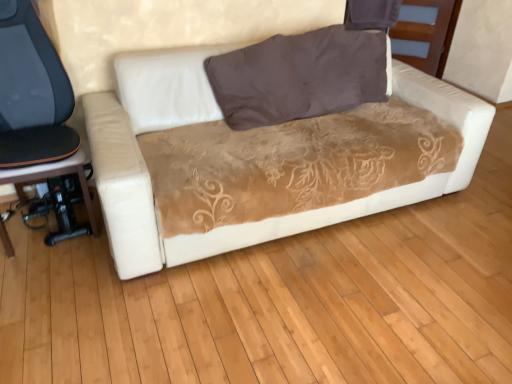
What do you see at coordinates (298, 76) in the screenshot? Image resolution: width=512 pixels, height=384 pixels. I see `brown velvety pillow at upper center` at bounding box center [298, 76].

The image size is (512, 384). What do you see at coordinates (35, 105) in the screenshot?
I see `black leather chair at left` at bounding box center [35, 105].

I want to click on black plastic music stool at lower left, so click(54, 176).

Between velvet brown couch at center and black leather chair at left, which one has more height?

black leather chair at left.

Is black leather chair at left a part of velvet brown couch at center?

No, black leather chair at left is not inside velvet brown couch at center.

What's the angular difference between velvet brown couch at center and black leather chair at left's facing directions?

1.01e-05 degrees separate the facing orientations of velvet brown couch at center and black leather chair at left.

Looking at the image, does velvet brown couch at center seem bigger or smaller compared to black leather chair at left?

Considering their sizes, velvet brown couch at center takes up more space than black leather chair at left.

Would you say brown velvety pillow at upper center is inside or outside black leather chair at left?

brown velvety pillow at upper center is spatially situated outside black leather chair at left.

Considering the relative sizes of brown velvety pillow at upper center and black leather chair at left in the image provided, is brown velvety pillow at upper center bigger than black leather chair at left?

Actually, brown velvety pillow at upper center might be smaller than black leather chair at left.

Is brown velvety pillow at upper center aimed at black leather chair at left?

No, brown velvety pillow at upper center is not turned towards black leather chair at left.

Considering their positions, is black plastic music stool at lower left located in front of or behind velvet brown couch at center?

Visually, black plastic music stool at lower left is located behind velvet brown couch at center.

Between point (3, 245) and point (117, 106), which one is positioned in front?

The point (3, 245) is closer.

You are a GUI agent. You are given a task and a screenshot of the screen. Output one action in this format:
    pyautogui.click(x=<x>, y=<y>)
    Task: Click on the studio couch above the black plastic music stool at lower left (from a real-world perspective)
    
    Given the screenshot: What is the action you would take?
    pyautogui.click(x=218, y=118)

Could velvet brown couch at center be considered to be inside black plastic music stool at lower left?

No, velvet brown couch at center is not inside black plastic music stool at lower left.

Can you tell me how much black plastic music stool at lower left and black leather chair at left differ in facing direction?

The angle between the facing direction of black plastic music stool at lower left and the facing direction of black leather chair at left is 2.86 degrees.

Is black plastic music stool at lower left positioned with its back to black leather chair at left?

Correct, black plastic music stool at lower left is looking away from black leather chair at left.

From a real-world perspective, which is physically above, black plastic music stool at lower left or black leather chair at left?

black leather chair at left.

Is black plastic music stool at lower left inside the boundaries of black leather chair at left, or outside?

black plastic music stool at lower left lies within the bounds of black leather chair at left.

From a real-world perspective, is brown velvety pillow at upper center located beneath black plastic music stool at lower left?

No, from a real-world perspective, brown velvety pillow at upper center is not below black plastic music stool at lower left.

Is brown velvety pillow at upper center surrounding black plastic music stool at lower left?

Actually, black plastic music stool at lower left is outside brown velvety pillow at upper center.

Which is in front, brown velvety pillow at upper center or black plastic music stool at lower left?

black plastic music stool at lower left.

Considering the relative positions of brown velvety pillow at upper center and black plastic music stool at lower left in the image provided, is brown velvety pillow at upper center to the left or to the right of black plastic music stool at lower left?

From the image, it's evident that brown velvety pillow at upper center is to the right of black plastic music stool at lower left.

Does brown velvety pillow at upper center appear on the right side of velvet brown couch at center?

Indeed, brown velvety pillow at upper center is positioned on the right side of velvet brown couch at center.

Is brown velvety pillow at upper center situated inside velvet brown couch at center or outside?

brown velvety pillow at upper center is located inside velvet brown couch at center.

Locate an element on the screen. This screenshot has height=384, width=512. studio couch lying on the left of brown velvety pillow at upper center is located at coordinates (218, 118).

Looking at their sizes, would you say brown velvety pillow at upper center is wider or thinner than velvet brown couch at center?

In the image, brown velvety pillow at upper center appears to be more narrow than velvet brown couch at center.

Locate an element on the screen. This screenshot has height=384, width=512. music stool below the velvet brown couch at center (from the image's perspective) is located at coordinates (54, 176).

Is velvet brown couch at center to the left or to the right of black plastic music stool at lower left in the image?

velvet brown couch at center is to the right of black plastic music stool at lower left.

Is velvet brown couch at center inside or outside of black plastic music stool at lower left?

velvet brown couch at center cannot be found inside black plastic music stool at lower left.

The width and height of the screenshot is (512, 384). In order to click on chair above the velvet brown couch at center (from a real-world perspective) in this screenshot , I will do `click(35, 105)`.

You are a GUI agent. You are given a task and a screenshot of the screen. Output one action in this format:
    pyautogui.click(x=<x>, y=<y>)
    Task: Click on the chair located underneath the brown velvety pillow at upper center (from a real-world perspective)
    The width and height of the screenshot is (512, 384).
    Given the screenshot: What is the action you would take?
    pyautogui.click(x=35, y=105)

Which object lies further to the anchor point brown velvety pillow at upper center, black plastic music stool at lower left or velvet brown couch at center?

The object further to brown velvety pillow at upper center is black plastic music stool at lower left.

Considering their positions, is brown velvety pillow at upper center positioned further to black leather chair at left than black plastic music stool at lower left?

brown velvety pillow at upper center is further to black leather chair at left.

In the scene shown: From the image, which object appears to be nearer to black plastic music stool at lower left, velvet brown couch at center or black leather chair at left?

black leather chair at left lies closer to black plastic music stool at lower left than the other object.

From the image, which object appears to be nearer to brown velvety pillow at upper center, black leather chair at left or velvet brown couch at center?

velvet brown couch at center is closer to brown velvety pillow at upper center.

Looking at the image, which one is located closer to black leather chair at left, velvet brown couch at center or black plastic music stool at lower left?

black plastic music stool at lower left is positioned closer to the anchor black leather chair at left.

Considering their positions, is velvet brown couch at center positioned closer to black plastic music stool at lower left than brown velvety pillow at upper center?

velvet brown couch at center is positioned closer to the anchor black plastic music stool at lower left.

Which object lies nearer to the anchor point black leather chair at left, velvet brown couch at center or brown velvety pillow at upper center?

velvet brown couch at center.

Which object lies nearer to the anchor point brown velvety pillow at upper center, black leather chair at left or black plastic music stool at lower left?

black leather chair at left lies closer to brown velvety pillow at upper center than the other object.

Identify the location of music stool between black leather chair at left and brown velvety pillow at upper center. (54, 176).

The width and height of the screenshot is (512, 384). What are the coordinates of `studio couch between black leather chair at left and brown velvety pillow at upper center in the horizontal direction` in the screenshot? It's located at (218, 118).

Find the location of a particular element. music stool between black leather chair at left and velvet brown couch at center is located at coordinates (54, 176).

Where is `studio couch between black plastic music stool at lower left and brown velvety pillow at upper center from left to right`? studio couch between black plastic music stool at lower left and brown velvety pillow at upper center from left to right is located at coordinates (218, 118).